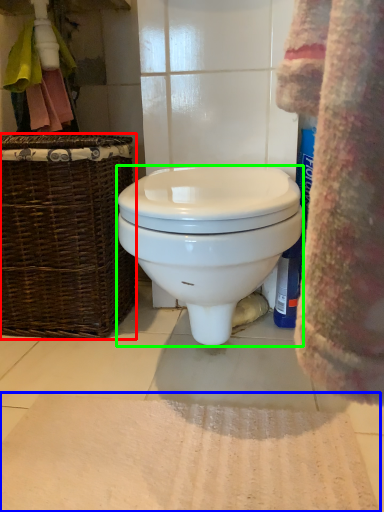
Question: Considering the real-world distances, which object is closest to picnic basket (highlighted by a red box)? bath mat (highlighted by a blue box) or toilet (highlighted by a green box).

Choices:
 (A) bath mat
 (B) toilet

Answer: (B)